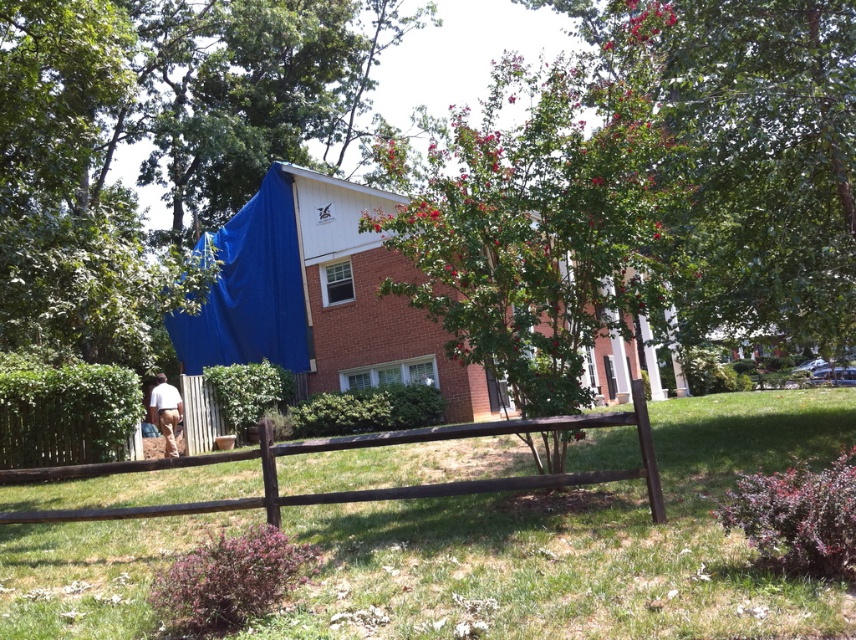
Does point (500, 264) come behind point (155, 406)?

That is False.

What do you see at coordinates (535, 221) in the screenshot?
I see `green leafy tree at center` at bounding box center [535, 221].

This screenshot has width=856, height=640. I want to click on green leafy tree at center, so click(535, 221).

Locate an element on the screen. brown wooden fence at lower left is located at coordinates pos(583,545).

Can you confirm if brown wooden fence at lower left is bigger than brown wooden fence at center?

Yes, brown wooden fence at lower left is bigger than brown wooden fence at center.

The image size is (856, 640). I want to click on brown wooden fence at lower left, so click(583, 545).

Is point (587, 557) positioned after point (538, 248)?

No.

Where is `brown wooden fence at lower left`? This screenshot has width=856, height=640. brown wooden fence at lower left is located at coordinates (583, 545).

This screenshot has width=856, height=640. Describe the element at coordinates (583, 545) in the screenshot. I see `brown wooden fence at lower left` at that location.

Image resolution: width=856 pixels, height=640 pixels. I want to click on brown wooden fence at lower left, so click(583, 545).